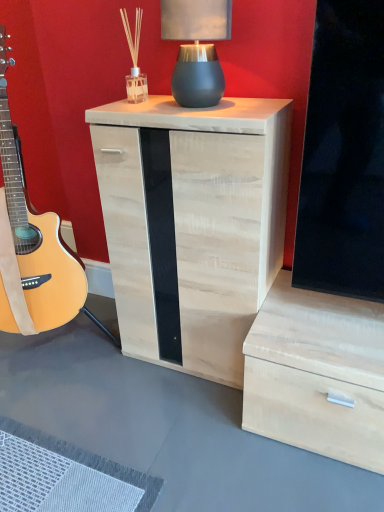
This screenshot has width=384, height=512. What are the coordinates of `vacant space positioned to the left of matte gray ceramic table lamp at upper center` in the screenshot? It's located at (148, 103).